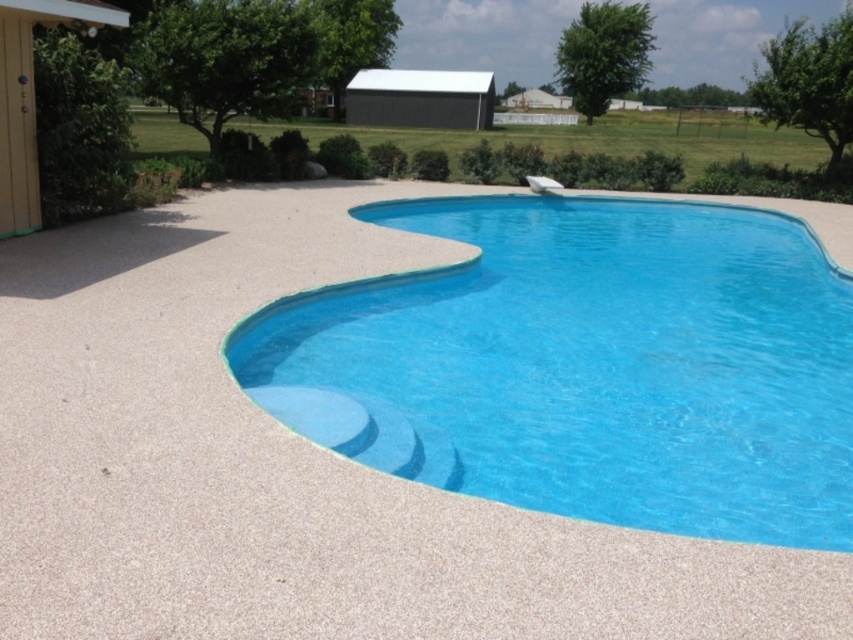
Question: Which point is farther to the camera?

Choices:
 (A) (677, 324)
 (B) (757, 170)

Answer: (B)

Question: Which point is closer to the camera taking this photo?

Choices:
 (A) (849, 193)
 (B) (386, 340)

Answer: (B)

Question: Is clear blue pool at center thinner than green grass at upper center?

Choices:
 (A) yes
 (B) no

Answer: (A)

Question: Considering the relative positions of clear blue pool at center and green grass at upper center in the image provided, where is clear blue pool at center located with respect to green grass at upper center?

Choices:
 (A) below
 (B) above

Answer: (A)

Question: Can you confirm if clear blue pool at center is positioned above green grass at upper center?

Choices:
 (A) yes
 (B) no

Answer: (B)